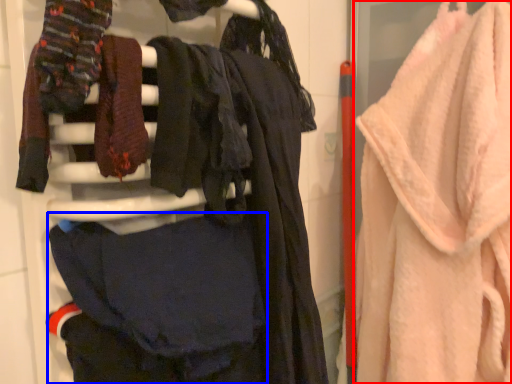
Question: Which point is further to the camera, towel (highlighted by a red box) or clothing (highlighted by a blue box)?

Choices:
 (A) towel
 (B) clothing

Answer: (A)